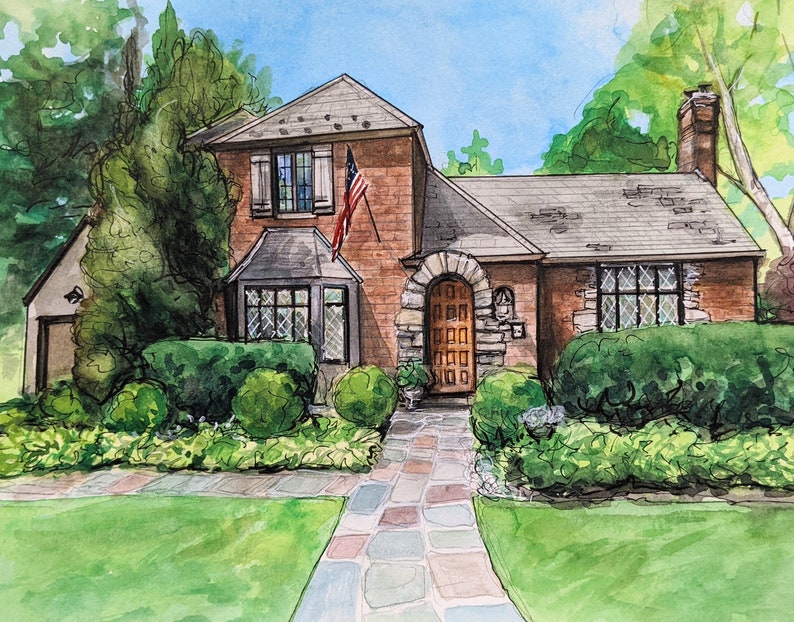
Find the location of `window on right`. window on right is located at coordinates (641, 303).